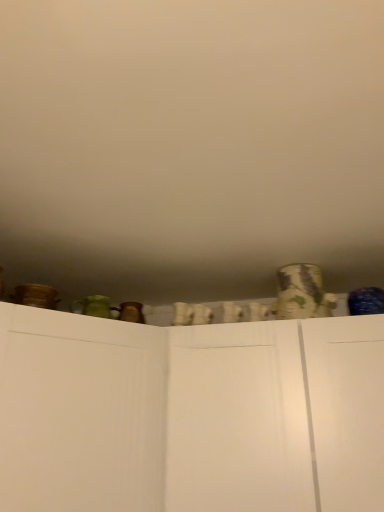
Question: Is white matte cupboard at center located within white matte wall at upper center?

Choices:
 (A) yes
 (B) no

Answer: (B)

Question: Does white matte wall at upper center have a lesser height compared to white matte cupboard at center?

Choices:
 (A) no
 (B) yes

Answer: (B)

Question: From the image's perspective, is white matte wall at upper center under white matte cupboard at center?

Choices:
 (A) yes
 (B) no

Answer: (B)

Question: Are white matte wall at upper center and white matte cupboard at center far apart?

Choices:
 (A) yes
 (B) no

Answer: (B)

Question: Is white matte wall at upper center positioned with its back to white matte cupboard at center?

Choices:
 (A) yes
 (B) no

Answer: (B)

Question: Does point (34, 51) appear closer or farther from the camera than point (29, 509)?

Choices:
 (A) closer
 (B) farther

Answer: (A)

Question: Is white matte wall at upper center bigger or smaller than white matte cupboard at center?

Choices:
 (A) small
 (B) big

Answer: (A)

Question: Considering the positions of white matte wall at upper center and white matte cupboard at center in the image, is white matte wall at upper center taller or shorter than white matte cupboard at center?

Choices:
 (A) tall
 (B) short

Answer: (B)

Question: In terms of width, does white matte wall at upper center look wider or thinner when compared to white matte cupboard at center?

Choices:
 (A) thin
 (B) wide

Answer: (B)

Question: Considering the positions of white matte wall at upper center and patterned ceramic vase at upper right in the image, is white matte wall at upper center wider or thinner than patterned ceramic vase at upper right?

Choices:
 (A) wide
 (B) thin

Answer: (A)

Question: Looking at the image, does white matte wall at upper center seem bigger or smaller compared to patterned ceramic vase at upper right?

Choices:
 (A) small
 (B) big

Answer: (B)

Question: Do you think white matte wall at upper center is within patterned ceramic vase at upper right, or outside of it?

Choices:
 (A) inside
 (B) outside

Answer: (B)

Question: From a real-world perspective, is white matte wall at upper center positioned above or below patterned ceramic vase at upper right?

Choices:
 (A) above
 (B) below

Answer: (A)

Question: Looking at their shapes, would you say patterned ceramic vase at upper right is wider or thinner than white matte cupboard at center?

Choices:
 (A) wide
 (B) thin

Answer: (B)

Question: Is patterned ceramic vase at upper right inside the boundaries of white matte cupboard at center, or outside?

Choices:
 (A) inside
 (B) outside

Answer: (B)